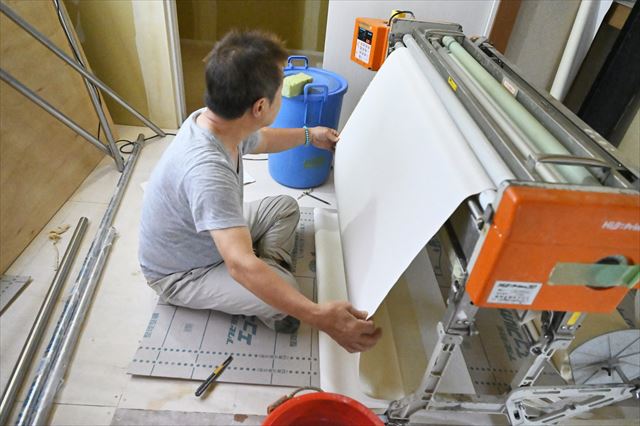
At what (x,y) coordinates should I click in order to perform the action: click on wood panel. Please return your answer as a coordinate pair (x, y). Image resolution: width=640 pixels, height=426 pixels. Looking at the image, I should click on (26, 148).